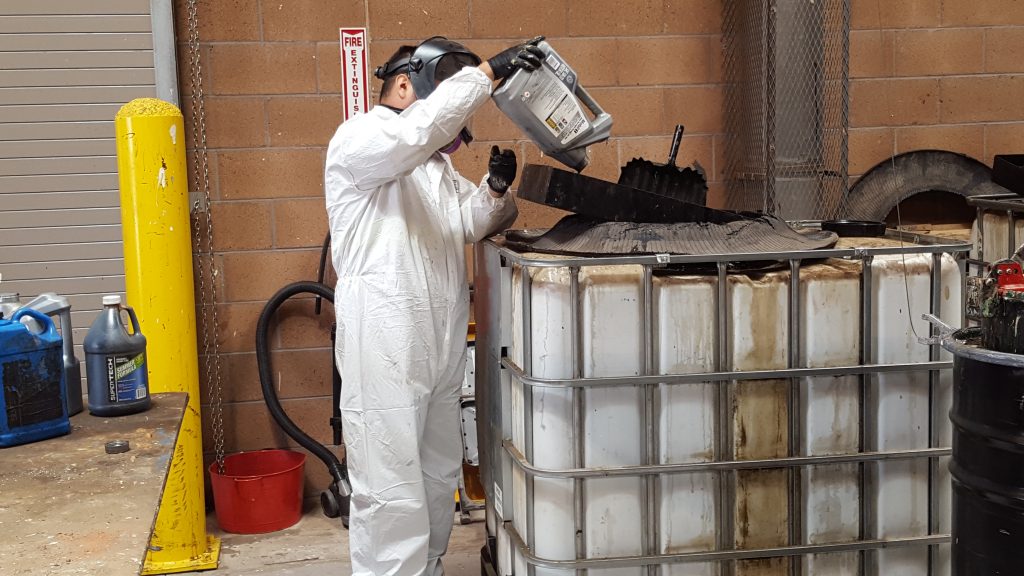
The width and height of the screenshot is (1024, 576). I want to click on brick wall, so click(243, 127).